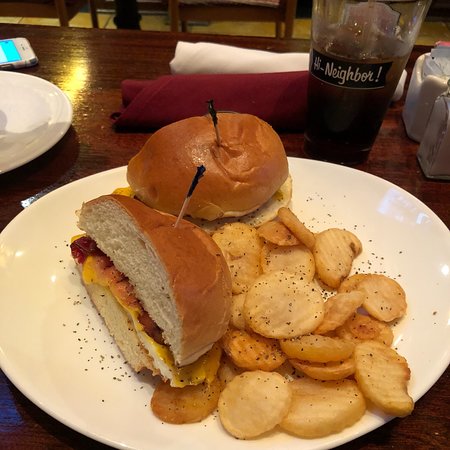
Locate an element on the screen. glass is located at coordinates (366, 61).